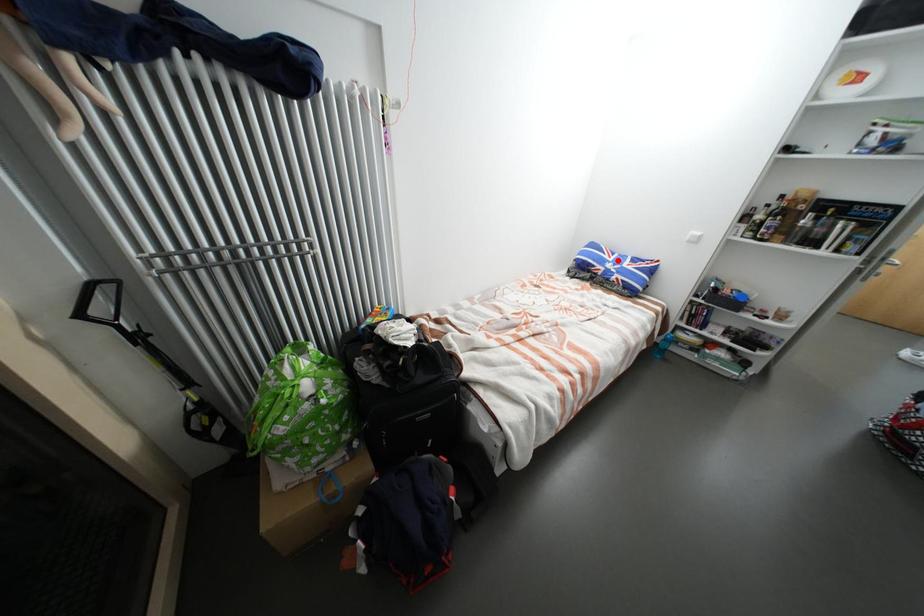
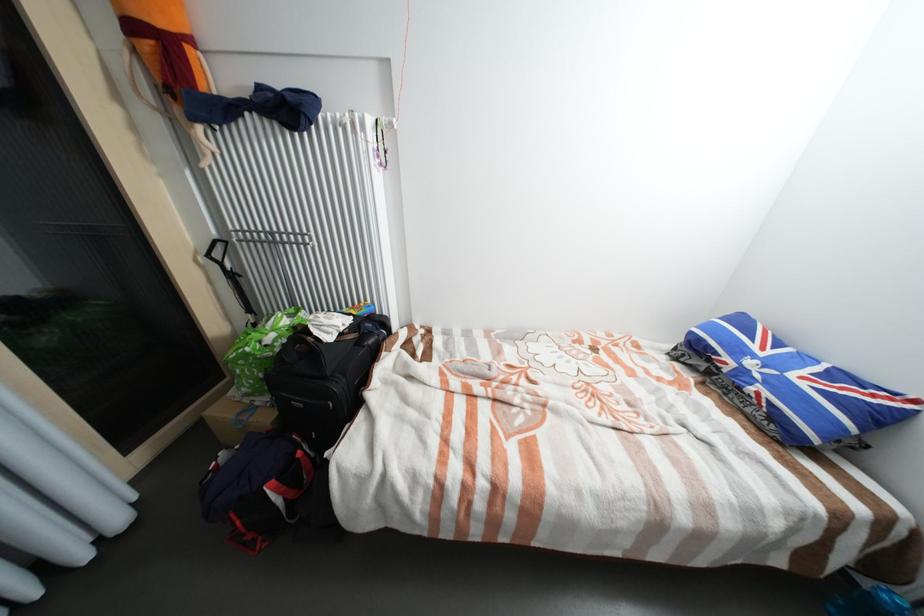
Question: I am providing you with two images of the same scene from different viewpoints. Image1 has a red point marked. In image2, the corresponding 3D location appears at what relative position? Reply with the corresponding letter.

Choices:
 (A) Closer
 (B) Farther

Answer: (B)